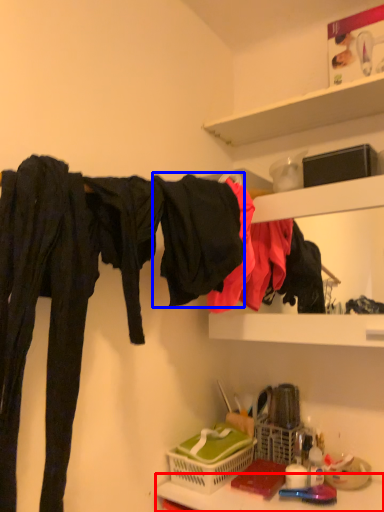
Question: Among these objects, which one is farthest to the camera, counter top (highlighted by a red box) or clothing (highlighted by a blue box)?

Choices:
 (A) counter top
 (B) clothing

Answer: (B)